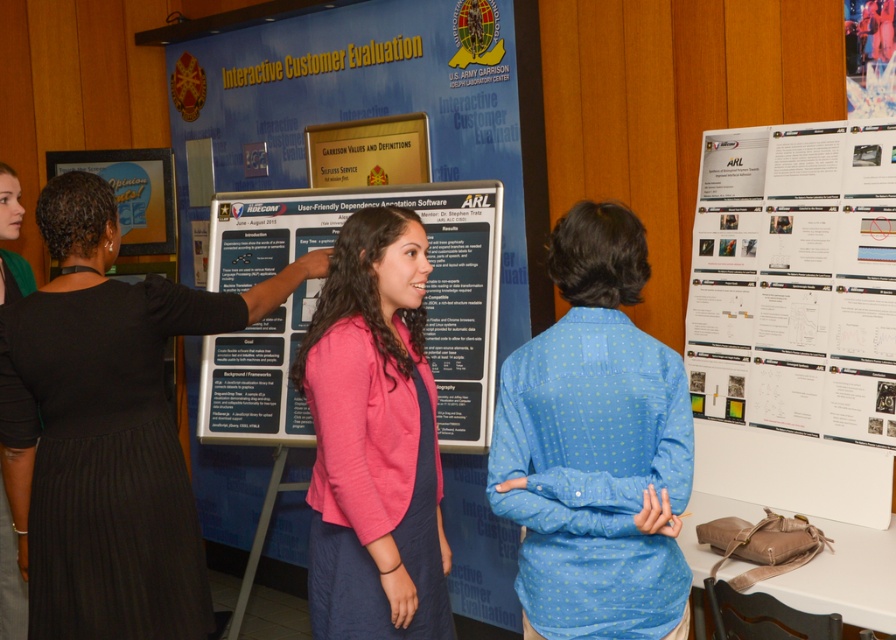
Question: Which point is closer to the camera?

Choices:
 (A) (76, 376)
 (B) (836, 216)

Answer: (A)

Question: Can you confirm if blue cardboard poster at center is thinner than black dress at center?

Choices:
 (A) yes
 (B) no

Answer: (B)

Question: Based on their relative distances, which object is farther from the white paper at right?

Choices:
 (A) white paper at center
 (B) blue cardboard poster at center
 (C) blue dotted shirt at center
 (D) black dress at center

Answer: (D)

Question: Can you confirm if blue cardboard poster at center is positioned above green fabric dress at left?

Choices:
 (A) yes
 (B) no

Answer: (A)

Question: Does blue cardboard poster at center have a larger size compared to black dress at center?

Choices:
 (A) no
 (B) yes

Answer: (B)

Question: Which of the following is the farthest from the observer?

Choices:
 (A) blue dotted shirt at center
 (B) black dress at center

Answer: (B)